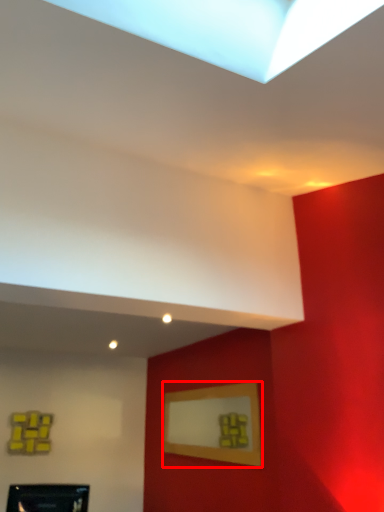
Question: From the image's perspective, where is picture frame (annotated by the red box) located in relation to picture frame in the image?

Choices:
 (A) above
 (B) below

Answer: (A)